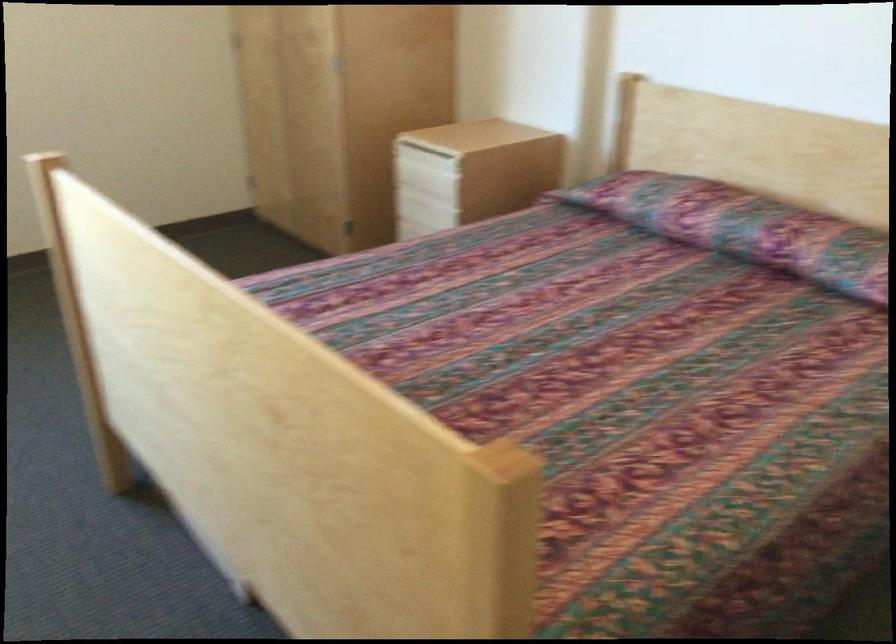
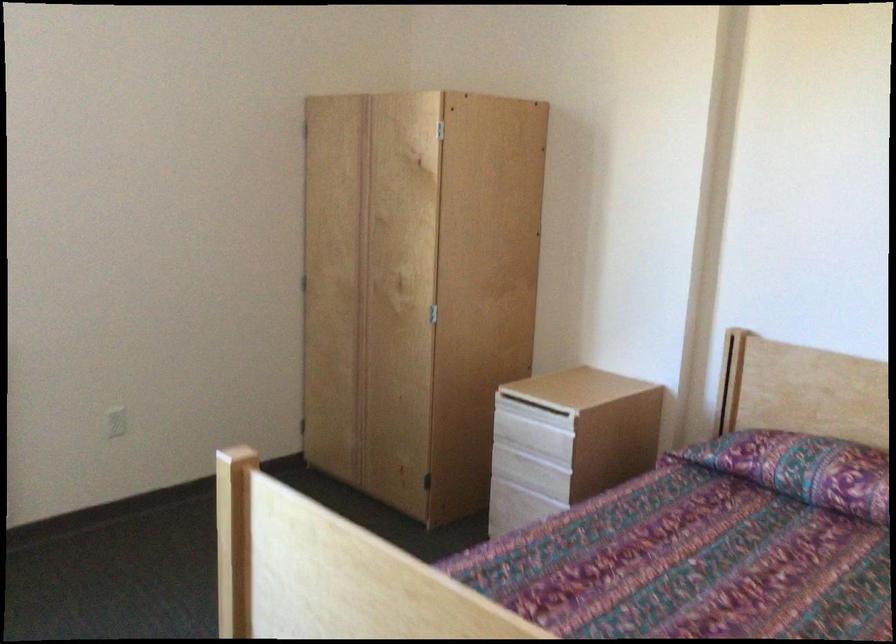
Which direction would the cameraman need to move to produce the second image?

The movement direction of the cameraman is left, forward.